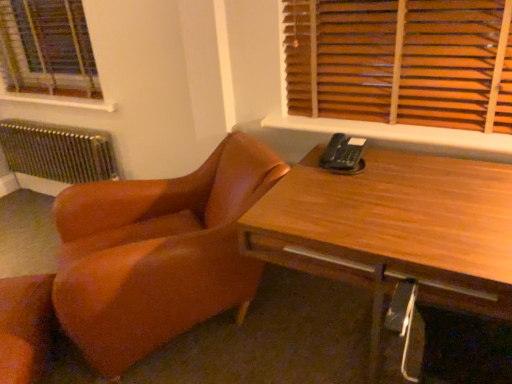
Question: Considering the relative sizes of wooden at upper right, marked as the 1th window sill in a right-to-left arrangement, and metallic radiator at left in the image provided, is wooden at upper right, marked as the 1th window sill in a right-to-left arrangement, bigger than metallic radiator at left?

Choices:
 (A) no
 (B) yes

Answer: (A)

Question: Is wooden at upper right, acting as the first window sill starting from the front, behind metallic radiator at left?

Choices:
 (A) no
 (B) yes

Answer: (A)

Question: Considering the relative positions of wooden at upper right, marked as the 1th window sill in a right-to-left arrangement, and metallic radiator at left in the image provided, is wooden at upper right, marked as the 1th window sill in a right-to-left arrangement, to the left of metallic radiator at left from the viewer's perspective?

Choices:
 (A) yes
 (B) no

Answer: (B)

Question: Is wooden at upper right, acting as the first window sill starting from the front, beside metallic radiator at left?

Choices:
 (A) yes
 (B) no

Answer: (B)

Question: Is wooden at upper right, acting as the first window sill starting from the front, thinner than metallic radiator at left?

Choices:
 (A) no
 (B) yes

Answer: (B)

Question: Is wooden blinds at upper right in front of or behind white wood window sill at upper left, marked as the 2th window sill in a front-to-back arrangement, in the image?

Choices:
 (A) front
 (B) behind

Answer: (A)

Question: From a real-world perspective, relative to white wood window sill at upper left, the 1th window sill when ordered from left to right, is wooden blinds at upper right vertically above or below?

Choices:
 (A) above
 (B) below

Answer: (A)

Question: In the image, is wooden blinds at upper right on the left side or the right side of white wood window sill at upper left, which is the first window sill from top to bottom?

Choices:
 (A) right
 (B) left

Answer: (A)

Question: Is point (481, 107) closer or farther from the camera than point (47, 104)?

Choices:
 (A) farther
 (B) closer

Answer: (B)

Question: Does point (3, 349) appear closer or farther from the camera than point (90, 359)?

Choices:
 (A) closer
 (B) farther

Answer: (A)

Question: Considering the relative positions of leather at lower left, the 1th chair positioned from the left, and brown leather chair at left, positioned as the second chair in left-to-right order, in the image provided, is leather at lower left, the 1th chair positioned from the left, to the left or to the right of brown leather chair at left, positioned as the second chair in left-to-right order,?

Choices:
 (A) left
 (B) right

Answer: (A)

Question: Based on their sizes in the image, would you say leather at lower left, the 1th chair positioned from the left, is bigger or smaller than brown leather chair at left, the 1th chair from the right?

Choices:
 (A) big
 (B) small

Answer: (B)

Question: From a real-world perspective, is leather at lower left, the second chair from the right, above or below brown leather chair at left, the 1th chair from the right?

Choices:
 (A) below
 (B) above

Answer: (A)

Question: Considering the positions of wooden blinds at upper right and wooden blinds at upper left in the image, is wooden blinds at upper right wider or thinner than wooden blinds at upper left?

Choices:
 (A) thin
 (B) wide

Answer: (A)

Question: Looking at the image, does wooden blinds at upper right seem bigger or smaller compared to wooden blinds at upper left?

Choices:
 (A) small
 (B) big

Answer: (A)